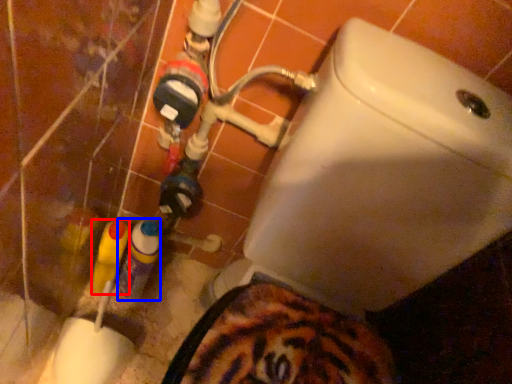
Question: Which object is closer to the camera taking this photo, bottle (highlighted by a red box) or bottle (highlighted by a blue box)?

Choices:
 (A) bottle
 (B) bottle

Answer: (A)